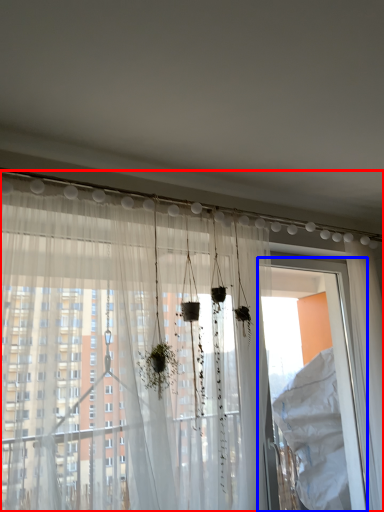
Question: Which point is further to the camera, curtain (highlighted by a red box) or screen door (highlighted by a blue box)?

Choices:
 (A) curtain
 (B) screen door

Answer: (B)